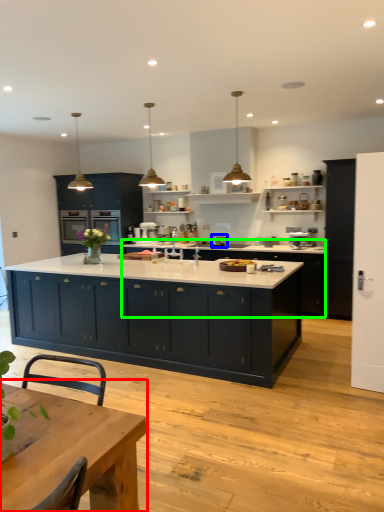
Question: Estimate the real-world distances between objects in this image. Which object is closer to table (highlighted by a red box), kitchen appliance (highlighted by a blue box) or cabinetry (highlighted by a green box)?

Choices:
 (A) kitchen appliance
 (B) cabinetry

Answer: (B)